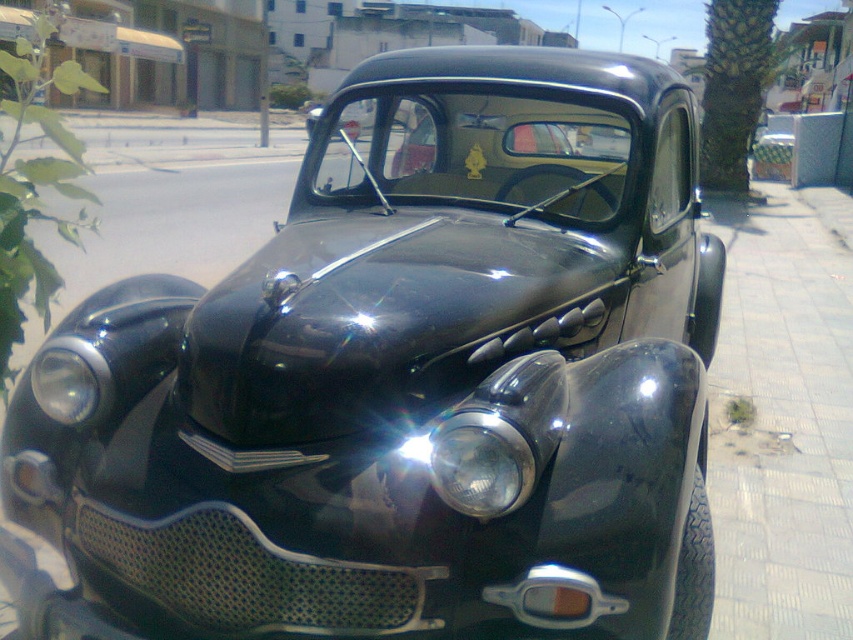
Question: Observing the image, what is the correct spatial positioning of green leafy palm tree at right in reference to glossy plastic headlight at center?

Choices:
 (A) below
 (B) above

Answer: (B)

Question: Estimate the real-world distances between objects in this image. Which object is farther from the green leafy palm tree at right?

Choices:
 (A) glossy plastic headlight at center
 (B) matte black headlight at center

Answer: (B)

Question: Can you confirm if green leafy palm tree at right is smaller than glossy plastic headlight at center?

Choices:
 (A) yes
 (B) no

Answer: (B)

Question: Which is nearer to the green leafy palm tree at right?

Choices:
 (A) glossy plastic headlight at center
 (B) matte black headlight at center

Answer: (A)

Question: Which point is farther to the camera?

Choices:
 (A) glossy plastic headlight at center
 (B) green leafy palm tree at right
 (C) matte black headlight at center

Answer: (B)

Question: Is green leafy palm tree at right closer to the viewer compared to matte black headlight at center?

Choices:
 (A) no
 (B) yes

Answer: (A)